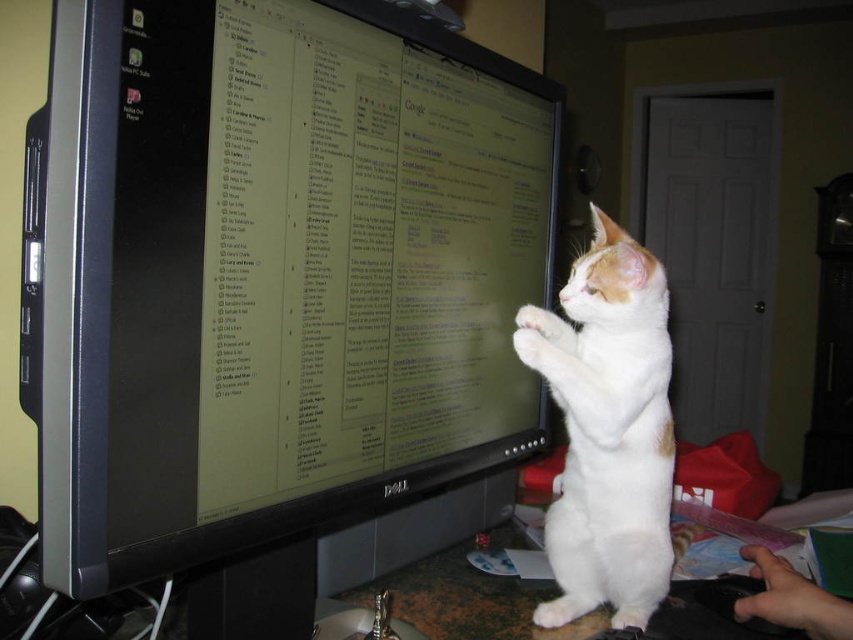
You are organizing your desk and need to move the white fur cat at right to the left side of the black glossy monitor at center. Is this possible based on their current positions?

The black glossy monitor at center is currently to the left of the white fur cat at right. To move the white fur cat at right to the left side of the black glossy monitor at center would require moving it past the monitor to the opposite side, which is feasible as long as there is enough space on the desk.

You are trying to place a new keyboard between the black glossy monitor at center and the white fur cat at right. Based on their widths, can the keyboard fit between them?

The black glossy monitor at center might be wider than white fur cat at right, so the keyboard might not fit between them if the monitor is wider.

You are a person sitting at the desk and want to reach for the black glossy monitor at center and the white fur cat at right. Which object is easier to reach without moving your chair?

The black glossy monitor at center is closer to the viewer than the white fur cat at right, so it is easier to reach without moving your chair.